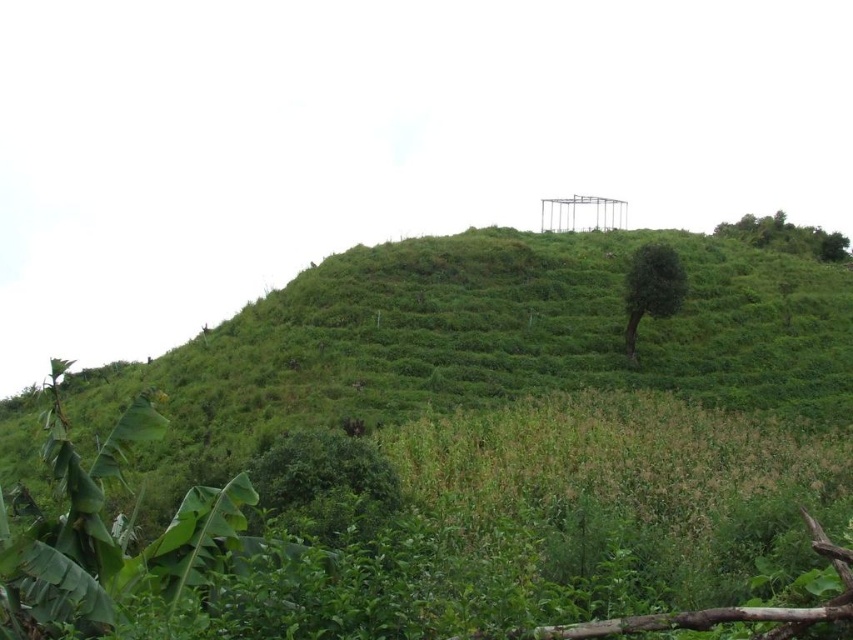
Question: Which point is closer to the camera?

Choices:
 (A) green leafy tree at upper right
 (B) green leafy tree at center

Answer: (B)

Question: Is green leafy tree at center in front of green leafy tree at upper right?

Choices:
 (A) no
 (B) yes

Answer: (B)

Question: Which point is farther to the camera?

Choices:
 (A) (666, 266)
 (B) (772, 228)

Answer: (B)

Question: Is green leafy tree at center closer to the viewer compared to green leafy tree at upper right?

Choices:
 (A) no
 (B) yes

Answer: (B)

Question: Does green leafy tree at center come in front of green leafy tree at upper right?

Choices:
 (A) yes
 (B) no

Answer: (A)